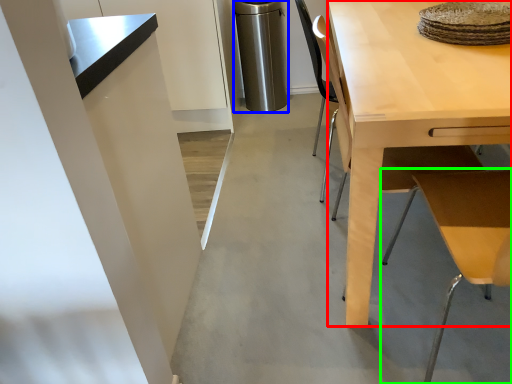
Question: Which object is positioned farthest from desk (highlighted by a red box)? Select from appliance (highlighted by a blue box) and table (highlighted by a green box).

Choices:
 (A) appliance
 (B) table

Answer: (A)